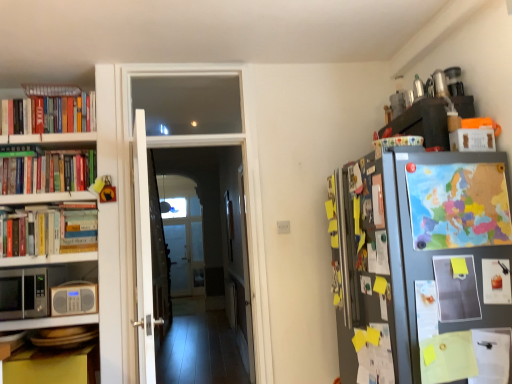
Identify the location of white wooden door at center. coord(244,176).

Describe the element at coordinates (244, 176) in the screenshot. I see `white wooden door at center` at that location.

What is the approximate width of beige plastic radio at lower left?

beige plastic radio at lower left is 2.88 inches in width.

Describe the element at coordinates (49, 229) in the screenshot. Image resolution: width=512 pixels, height=384 pixels. I see `hardcover books at left, marked as the third book in a left-to-right arrangement` at that location.

Measure the distance between point [46,326] and camera.

Point [46,326] is 8.96 feet from camera.

This screenshot has height=384, width=512. Identify the location of white wooden door at center, the 3th door from the left. (246, 276).

Can you confirm if hardcover books at left, the third book in the right-to-left sequence, is shorter than black matte microwave at left?

No.

Is hardcover books at left, the third book in the right-to-left sequence, not inside black matte microwave at left?

Yes, hardcover books at left, the third book in the right-to-left sequence, is outside of black matte microwave at left.

How far apart are hardcover books at left, which ranks as the 3th book in back-to-front order, and black matte microwave at left?

hardcover books at left, which ranks as the 3th book in back-to-front order, is 11.13 inches from black matte microwave at left.

Which point is more distant from viewer, (x=29, y=218) or (x=26, y=327)?

The point (x=29, y=218) is behind.

How many degrees apart are the facing directions of hardcover books at left, the third book positioned from the front, and metallic silver microwave at left?

hardcover books at left, the third book positioned from the front, and metallic silver microwave at left are facing 1.74 degrees away from each other.

From the image's perspective, which object appears higher, hardcover books at left, which ranks as the 3th book in back-to-front order, or metallic silver microwave at left?

hardcover books at left, which ranks as the 3th book in back-to-front order, from the image's perspective.

Is hardcover books at left, marked as the third book in a left-to-right arrangement, wider than metallic silver microwave at left?

Incorrect, the width of hardcover books at left, marked as the third book in a left-to-right arrangement, does not surpass that of metallic silver microwave at left.

Does white paper at right, which appears as the 5th book when viewed from the back, turn towards white wooden door at center?

No, white paper at right, which appears as the 5th book when viewed from the back, is not oriented towards white wooden door at center.

Is white paper at right, placed as the first book when sorted from front to back, bigger than white wooden door at center?

No, white paper at right, placed as the first book when sorted from front to back, is not bigger than white wooden door at center.

From the image's perspective, which object appears higher, white paper at right, placed as the first book when sorted from front to back, or white wooden door at center?

white wooden door at center, from the image's perspective.

How many degrees apart are the facing directions of white paper at right, the second book in the right-to-left sequence, and white wooden door at center?

0.391 degrees separate the facing orientations of white paper at right, the second book in the right-to-left sequence, and white wooden door at center.

Which of these two, colorful paper map at right, which is the second book from front to back, or white wooden door at center, the first door when ordered from left to right, is smaller?

With smaller size is colorful paper map at right, which is the second book from front to back.

Where is `door that is the 1st object located below the colorful paper map at right, which is the second book from front to back (from the image's perspective)`? This screenshot has width=512, height=384. door that is the 1st object located below the colorful paper map at right, which is the second book from front to back (from the image's perspective) is located at coordinates (143, 253).

Does point (502, 208) come in front of point (152, 359)?

That is True.

Are colorful paper map at right, which is the second book from front to back, and black matte microwave at left far apart?

colorful paper map at right, which is the second book from front to back, is positioned a significant distance from black matte microwave at left.

Considering the sizes of objects colorful paper map at right, which appears as the first book when viewed from the right, and black matte microwave at left in the image provided, who is thinner, colorful paper map at right, which appears as the first book when viewed from the right, or black matte microwave at left?

Thinner between the two is colorful paper map at right, which appears as the first book when viewed from the right.

In the scene shown: Between colorful paper map at right, which is the 5th book in left-to-right order, and black matte microwave at left, which one has less height?

black matte microwave at left.

Which is less distant, (447, 203) or (46, 270)?

→ Point (447, 203) is closer to the camera than point (46, 270).

Is white wooden door at center completely or partially outside of hardcover books at left, marked as the third book in a left-to-right arrangement?

white wooden door at center lies outside hardcover books at left, marked as the third book in a left-to-right arrangement,'s area.

Can you tell me how much white wooden door at center and hardcover books at left, marked as the third book in a left-to-right arrangement, differ in facing direction?

The angular difference between white wooden door at center and hardcover books at left, marked as the third book in a left-to-right arrangement, is 1.77 degrees.

From the image's perspective, is white wooden door at center above or below hardcover books at left, which ranks as the 3th book in back-to-front order?

white wooden door at center is above hardcover books at left, which ranks as the 3th book in back-to-front order.

Considering the relative sizes of white wooden door at center and hardcover books at left, marked as the third book in a left-to-right arrangement, in the image provided, is white wooden door at center smaller than hardcover books at left, marked as the third book in a left-to-right arrangement,?

No.

Would you say white wooden door at center, the first door when ordered from left to right, is outside hardcover books at left, arranged as the 5th book when viewed from the front?

A: That's correct, white wooden door at center, the first door when ordered from left to right, is outside of hardcover books at left, arranged as the 5th book when viewed from the front.

Starting from the hardcover books at left, placed as the first book when sorted from left to right, which door is the 1st one to the right? Please provide its 2D coordinates.

[(143, 253)]

Are white wooden door at center, the first door when ordered from left to right, and hardcover books at left, the 5th book when ordered from right to left, beside each other?

No, white wooden door at center, the first door when ordered from left to right, is not in contact with hardcover books at left, the 5th book when ordered from right to left.

Based on their positions, is white wooden door at center, arranged as the 3th door when viewed from the right, located to the left or right of hardcover books at left, the first book positioned from the back?

Clearly, white wooden door at center, arranged as the 3th door when viewed from the right, is on the right of hardcover books at left, the first book positioned from the back, in the image.

Locate an element on the screen. microwave oven that is below the hardcover books at left, marked as the third book in a left-to-right arrangement (from the image's perspective) is located at coordinates (24, 293).

Which book is the 1st one when counting from the left side of the metallic silver microwave at left? Please provide its 2D coordinates.

[(49, 229)]

Considering their positions, is black matte microwave at left positioned further to white wooden door at center, the first door when ordered from left to right, than hardcover books at left, the first book positioned from the back?

hardcover books at left, the first book positioned from the back, lies further to white wooden door at center, the first door when ordered from left to right, than the other object.

Estimate the real-world distances between objects in this image. Which object is closer to white paper at right, the second book in the right-to-left sequence, white glossy door at center, positioned as the 2th door in right-to-left order, or colorful paper map at right, which is the 5th book in left-to-right order?

colorful paper map at right, which is the 5th book in left-to-right order, is positioned closer to the anchor white paper at right, the second book in the right-to-left sequence.

From the picture: Which object lies further to the anchor point colorful paper map at right, which appears as the first book when viewed from the right, white paper at right, which ranks as the 4th book in left-to-right order, or hardcover books at left, arranged as the 5th book when viewed from the front?

hardcover books at left, arranged as the 5th book when viewed from the front, lies further to colorful paper map at right, which appears as the first book when viewed from the right, than the other object.

From the image, which object appears to be nearer to white wooden door at center, the first door when ordered from left to right, beige plastic radio at lower left or hardcover books at left, the third book in the right-to-left sequence?

beige plastic radio at lower left lies closer to white wooden door at center, the first door when ordered from left to right, than the other object.

Based on their spatial positions, is hardcover books at left, the third book in the right-to-left sequence, or black matte microwave at left closer to hardcover books at left, the 4th book viewed from the right?

hardcover books at left, the third book in the right-to-left sequence, lies closer to hardcover books at left, the 4th book viewed from the right, than the other object.

Estimate the real-world distances between objects in this image. Which object is closer to hardcover books at left, the 2th book when ordered from back to front, white wooden door at center or beige plastic radio at lower left?

The object closer to hardcover books at left, the 2th book when ordered from back to front, is white wooden door at center.

Considering their positions, is white paper at right, the second book in the right-to-left sequence, positioned closer to beige plastic radio at lower left than hardcover books at left, arranged as the 5th book when viewed from the front?

The object closer to beige plastic radio at lower left is hardcover books at left, arranged as the 5th book when viewed from the front.

Estimate the real-world distances between objects in this image. Which object is further from black matte microwave at left, white wooden door at center, the 3th door from the left, or beige plastic radio at lower left?

white wooden door at center, the 3th door from the left, is further to black matte microwave at left.

Where is `corridor between hardcover books at left, the first book positioned from the back, and beige plastic radio at lower left from top to bottom`? Image resolution: width=512 pixels, height=384 pixels. corridor between hardcover books at left, the first book positioned from the back, and beige plastic radio at lower left from top to bottom is located at coordinates (244, 176).

Where is `door situated between hardcover books at left, the 4th book viewed from the right, and white wooden door at center from left to right`? door situated between hardcover books at left, the 4th book viewed from the right, and white wooden door at center from left to right is located at coordinates (143, 253).

I want to click on shelf located between hardcover books at left, the first book positioned from the back, and white paper at right, which ranks as the 4th book in left-to-right order, in the left-right direction, so click(48, 322).

The image size is (512, 384). I want to click on microwave oven between hardcover books at left, the third book in the right-to-left sequence, and metallic silver microwave at left in the up-down direction, so click(x=24, y=293).